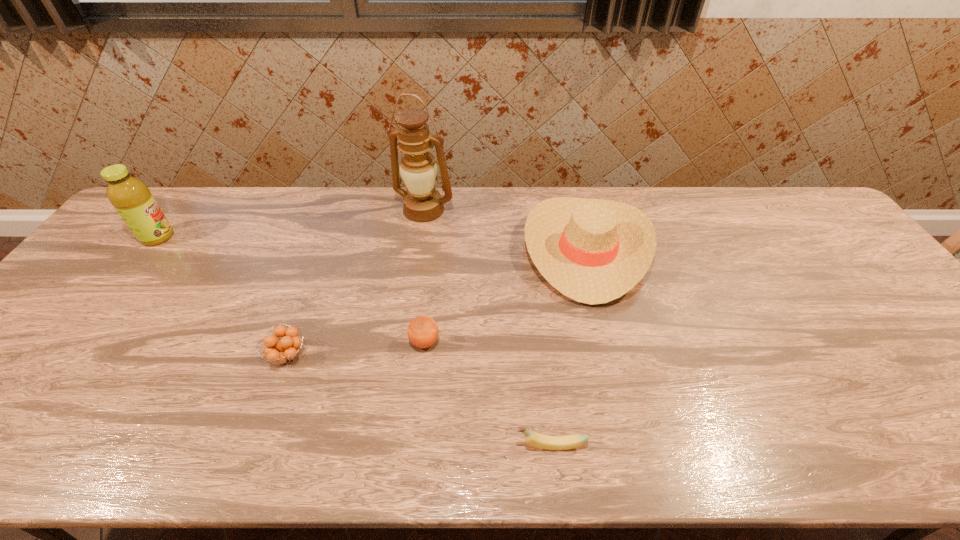
The height and width of the screenshot is (540, 960). I want to click on empty space that is in between the tallest object and the left orange fruit, so click(x=356, y=282).

The image size is (960, 540). I want to click on vacant space in between the right orange fruit and the tallest object, so click(424, 276).

This screenshot has width=960, height=540. What are the coordinates of `free spot between the nearest object and the fifth object from right to left` in the screenshot? It's located at (419, 400).

The height and width of the screenshot is (540, 960). What are the coordinates of `object that can be found as the third closest to the fifth object from right to left` in the screenshot? It's located at (537, 440).

Where is `the fifth closest object to the nearest object`? the fifth closest object to the nearest object is located at coordinates (132, 199).

Identify the location of vacant space that satisfies the following two spatial constraints: 1. on the front label of the right orange fruit; 2. on the right side of the leftmost object. The width and height of the screenshot is (960, 540). (77, 342).

Locate an element on the screen. This screenshot has width=960, height=540. free space that satisfies the following two spatial constraints: 1. on the front label of the fifth shortest object; 2. on the right side of the right orange fruit is located at coordinates (77, 342).

Identify the location of vacant space that satisfies the following two spatial constraints: 1. on the back side of the sunhat; 2. on the front label of the leftmost object. This screenshot has width=960, height=540. (583, 237).

Find the location of a particular element. This screenshot has height=540, width=960. free point that satisfies the following two spatial constraints: 1. on the back side of the right orange fruit; 2. on the left side of the sunhat is located at coordinates (434, 250).

Locate an element on the screen. This screenshot has width=960, height=540. free location that satisfies the following two spatial constraints: 1. on the front label of the fruit juice; 2. on the back side of the third tallest object is located at coordinates (148, 250).